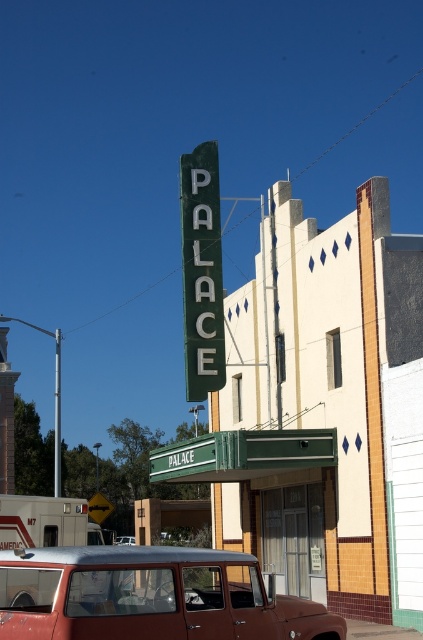
You are standing in front of the theater and want to take a photo of the green metallic sign at upper center without the rustic metal station wagon at center blocking it. Which direction should you move to ensure the sign is fully visible?

The green metallic sign at upper center is taller than the rustic metal station wagon at center. To ensure the sign is fully visible, move to a position where you can look upward, as the sign is taller and positioned above the wagon.

You are a delivery person trying to deliver a package to the theater office located behind the green metallic sign at upper center. The rustic metal station wagon at center is blocking the entrance. Can you estimate whether the station wagon can be moved aside to allow access to the entrance?

The rustic metal station wagon at center is smaller in size compared to the green metallic sign at upper center, so it can be moved aside to allow access to the entrance behind the green metallic sign at upper center.